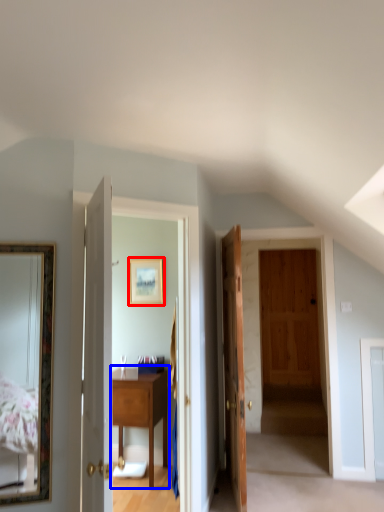
Question: Which of the following is the farthest to the observer, picture frame (highlighted by a red box) or table (highlighted by a blue box)?

Choices:
 (A) picture frame
 (B) table

Answer: (A)